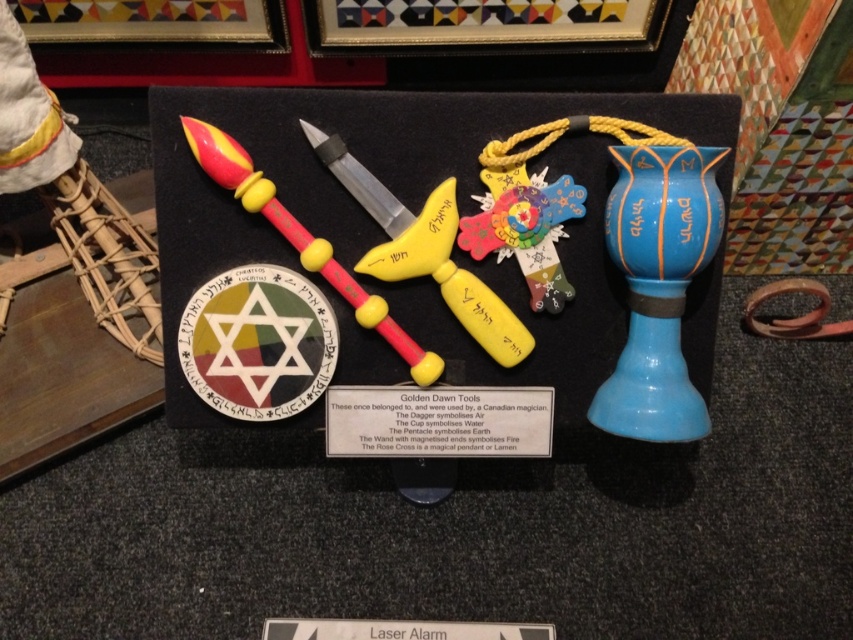
Can you confirm if wooden circular object at center is smaller than yellow matte knife at center?

Indeed, wooden circular object at center has a smaller size compared to yellow matte knife at center.

Is wooden circular object at center to the left of yellow matte knife at center from the viewer's perspective?

Correct, you'll find wooden circular object at center to the left of yellow matte knife at center.

Is point (241, 362) less distant than point (496, 300)?

Yes, it is in front of point (496, 300).

Locate an element on the screen. The height and width of the screenshot is (640, 853). wooden circular object at center is located at coordinates click(x=258, y=342).

Looking at this image, who is shorter, yellow matte knife at center or matte plastic wand at center?

With less height is yellow matte knife at center.

Is point (392, 273) closer to viewer compared to point (397, 326)?

Yes, point (392, 273) is in front of point (397, 326).

This screenshot has width=853, height=640. Find the location of `yellow matte knife at center`. yellow matte knife at center is located at coordinates (425, 250).

From the picture: Who is more distant from viewer, (625, 410) or (212, 384)?

Point (212, 384)

Does blue glossy cup at upper right appear under wooden circular object at center?

Actually, blue glossy cup at upper right is above wooden circular object at center.

Locate an element on the screen. This screenshot has height=640, width=853. blue glossy cup at upper right is located at coordinates (659, 285).

Find the location of a particular element. The image size is (853, 640). blue glossy cup at upper right is located at coordinates (659, 285).